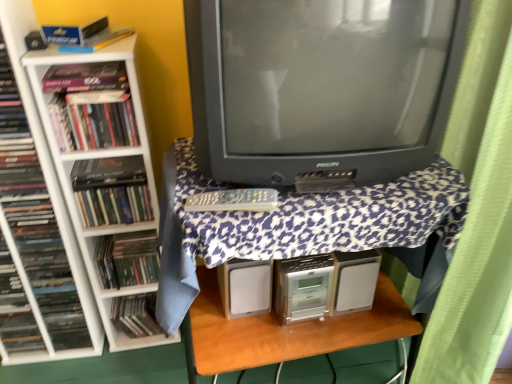
Question: Based on their sizes in the image, would you say matte black book at left, the 7th book in the right-to-left sequence, is bigger or smaller than white plastic bookcase at left?

Choices:
 (A) small
 (B) big

Answer: (A)

Question: From the image's perspective, is matte black book at left, the 7th book in the right-to-left sequence, above or below white plastic bookcase at left?

Choices:
 (A) above
 (B) below

Answer: (B)

Question: Considering the real-world distances, which object is closest to the gray plastic remote at center?

Choices:
 (A) matte black book at left, the third book positioned from the right
 (B) matte black television at center
 (C) hardcover book at left, the fourth book when ordered from right to left
 (D) green fabric curtain at right
 (E) matte black book at left, the first book when ordered from right to left

Answer: (B)

Question: Considering the real-world distances, which object is farthest from the matte black book at left, the 7th book in the right-to-left sequence?

Choices:
 (A) matte black book at left, acting as the seventh book starting from the left
 (B) hardcover book at left, the 6th book positioned from the right
 (C) hardcover book at left, which is counted as the fourth book, starting from the left
 (D) gray plastic remote at center
 (E) matte black television at center

Answer: (E)